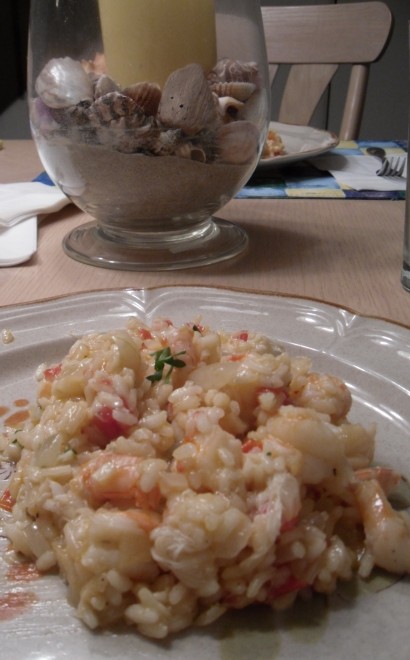
At what (x,y) coordinates should I click in order to perform the action: click on placemat. Please return your answer as a coordinate pair (x, y). Looking at the image, I should click on (337, 169).